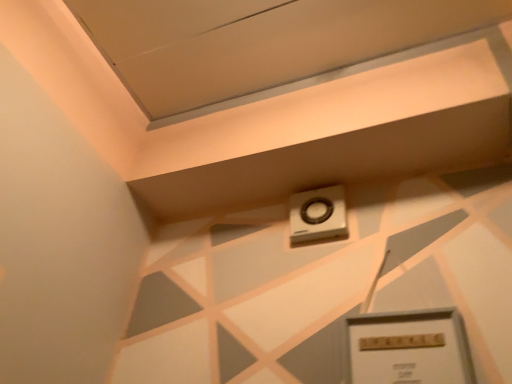
Question: Is metallic gray thermostat at upper center outside of white plastic alarm at upper center?

Choices:
 (A) yes
 (B) no

Answer: (A)

Question: Considering the relative sizes of metallic gray thermostat at upper center and white plastic alarm at upper center in the image provided, is metallic gray thermostat at upper center taller than white plastic alarm at upper center?

Choices:
 (A) no
 (B) yes

Answer: (B)

Question: From the image's perspective, is metallic gray thermostat at upper center on top of white plastic alarm at upper center?

Choices:
 (A) no
 (B) yes

Answer: (A)

Question: Is metallic gray thermostat at upper center further to camera compared to white plastic alarm at upper center?

Choices:
 (A) yes
 (B) no

Answer: (B)

Question: Is white plastic alarm at upper center surrounded by metallic gray thermostat at upper center?

Choices:
 (A) no
 (B) yes

Answer: (A)

Question: Is metallic gray thermostat at upper center next to white plastic alarm at upper center and touching it?

Choices:
 (A) no
 (B) yes

Answer: (A)

Question: From a real-world perspective, does white plastic alarm at upper center stand above metallic gray thermostat at upper center?

Choices:
 (A) no
 (B) yes

Answer: (B)

Question: Does white plastic alarm at upper center appear on the left side of metallic gray thermostat at upper center?

Choices:
 (A) no
 (B) yes

Answer: (B)

Question: Considering the relative positions of white plastic alarm at upper center and metallic gray thermostat at upper center in the image provided, is white plastic alarm at upper center to the right of metallic gray thermostat at upper center from the viewer's perspective?

Choices:
 (A) no
 (B) yes

Answer: (A)

Question: Is white plastic alarm at upper center bigger than metallic gray thermostat at upper center?

Choices:
 (A) no
 (B) yes

Answer: (A)

Question: Considering the relative sizes of white plastic alarm at upper center and metallic gray thermostat at upper center in the image provided, is white plastic alarm at upper center shorter than metallic gray thermostat at upper center?

Choices:
 (A) no
 (B) yes

Answer: (B)

Question: Does white plastic alarm at upper center have a greater width compared to metallic gray thermostat at upper center?

Choices:
 (A) yes
 (B) no

Answer: (A)

Question: Considering the positions of metallic gray thermostat at upper center and white plastic alarm at upper center in the image, is metallic gray thermostat at upper center bigger or smaller than white plastic alarm at upper center?

Choices:
 (A) small
 (B) big

Answer: (B)